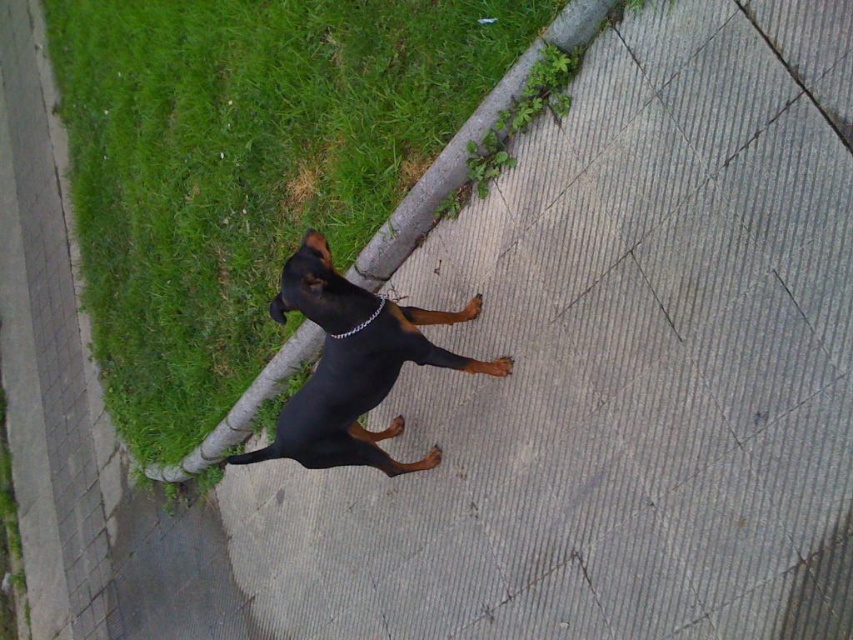
You are standing on the textured concrete sidewalk where the Doberman Pinscher is located. You want to walk to the point marked at coordinates (x=244, y=166). Based on the scene description, will you need to step onto the grass to reach that point?

The point at coordinates (x=244, y=166) is on green grass at upper left, so yes, you will need to step onto the grass to reach that point.